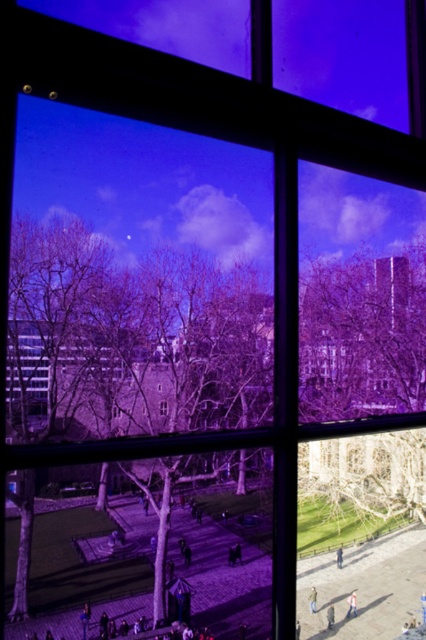
You are standing inside the building looking through the window. There are two points marked on the window pane. The first point is at coordinates point (313,588) and the second is at point (163,412). Which point is closer to you as you look through the window?

Point (313,588) is in front of point (163,412), so it is closer to you as you look through the window.

You are a delivery person standing at the entrance of the building, and you need to deliver a package to the person wearing the khaki fabric jacket at lower right. The light brown leather jacket at center is blocking your path. Can you walk around them without getting too close? Please explain.

The distance between the khaki fabric jacket at lower right and the light brown leather jacket at center is 1.30 meters. Since the light brown leather jacket at center is blocking the path, you can walk around them by maintaining a distance of at least 1.30 meters to ensure you don not get too close.